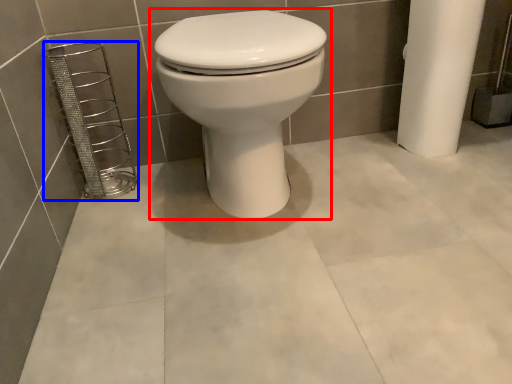
Question: Which point is closer to the camera, toilet (highlighted by a red box) or porcelain (highlighted by a blue box)?

Choices:
 (A) toilet
 (B) porcelain

Answer: (A)